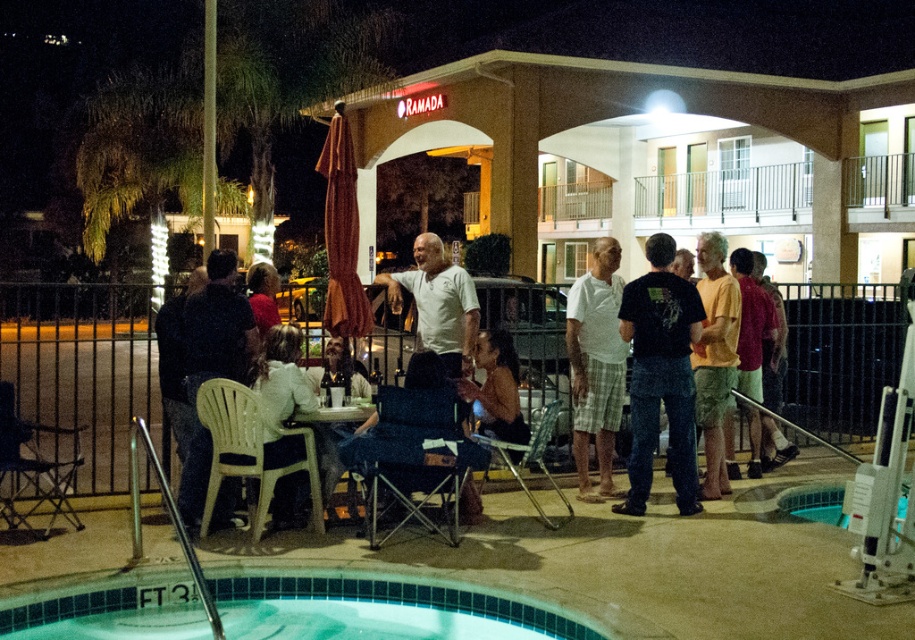
Question: Can you confirm if matte white chair at center is positioned to the right of white plaid shorts at center?

Choices:
 (A) yes
 (B) no

Answer: (A)

Question: Does matte white chair at center appear under dark blue jeans at lower left?

Choices:
 (A) no
 (B) yes

Answer: (A)

Question: Which object appears farthest from the camera in this image?

Choices:
 (A) dark blue jeans at lower left
 (B) black cotton t-shirt at center
 (C) blue tile swimming pool at lower left
 (D) matte white chair at center

Answer: (B)

Question: Does black cotton t-shirt at center appear under camouflage shorts at center?

Choices:
 (A) yes
 (B) no

Answer: (A)

Question: Which point is closer to the camera taking this photo?

Choices:
 (A) (221, 376)
 (B) (707, 387)

Answer: (A)

Question: Which of the following is the farthest from the observer?

Choices:
 (A) blue tile swimming pool at lower left
 (B) camouflage shorts at center
 (C) white plaid shorts at center

Answer: (C)